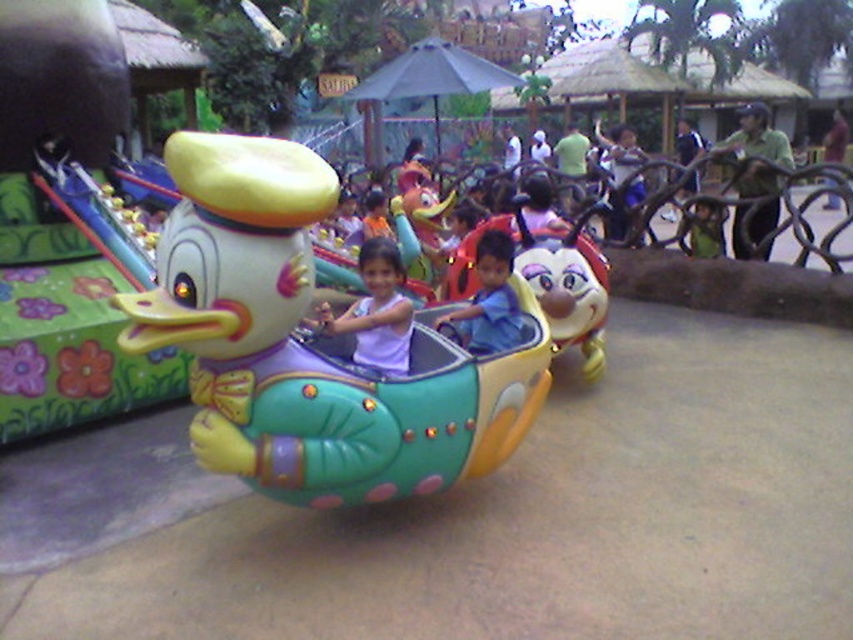
Question: Which of these objects is positioned farthest from the matte purple shirt at center?

Choices:
 (A) blue cotton shirt at center
 (B) shiny plastic bee at center
 (C) matte yellow duck at center
 (D) glossy plastic duck at center

Answer: (C)

Question: Which object appears closest to the camera in this image?

Choices:
 (A) shiny plastic bee at center
 (B) blue cotton shirt at center

Answer: (B)

Question: In this image, where is matte purple shirt at center located relative to blue cotton shirt at center?

Choices:
 (A) below
 (B) above

Answer: (A)

Question: Which object appears farthest from the camera in this image?

Choices:
 (A) matte yellow duck at center
 (B) blue cotton shirt at center
 (C) shiny plastic bee at center

Answer: (C)

Question: Can you confirm if glossy plastic duck at center is bigger than shiny plastic bee at center?

Choices:
 (A) yes
 (B) no

Answer: (A)

Question: Can you confirm if matte yellow duck at center is smaller than shiny plastic bee at center?

Choices:
 (A) no
 (B) yes

Answer: (A)